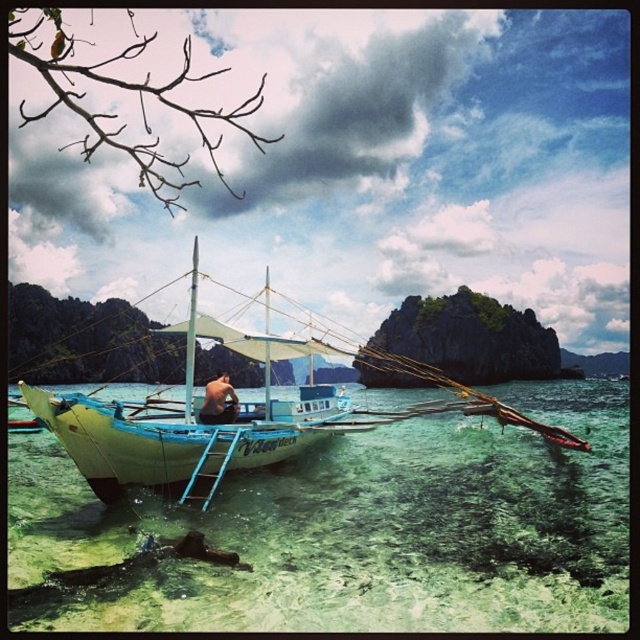
Question: Is the position of clear glassy water at center more distant than that of light blue wooden boat at center?

Choices:
 (A) no
 (B) yes

Answer: (A)

Question: Which of the following is the farthest from the observer?

Choices:
 (A) light blue wooden boat at center
 (B) clear glassy water at center
 (C) skinny man at center

Answer: (C)

Question: Which object appears closest to the camera in this image?

Choices:
 (A) clear glassy water at center
 (B) light blue wooden boat at center

Answer: (A)

Question: Which of the following is the closest to the observer?

Choices:
 (A) light blue wooden boat at center
 (B) skinny man at center
 (C) clear glassy water at center

Answer: (C)

Question: Is clear glassy water at center to the right of light blue wooden boat at center from the viewer's perspective?

Choices:
 (A) no
 (B) yes

Answer: (B)

Question: Does light blue wooden boat at center have a larger size compared to skinny man at center?

Choices:
 (A) yes
 (B) no

Answer: (A)